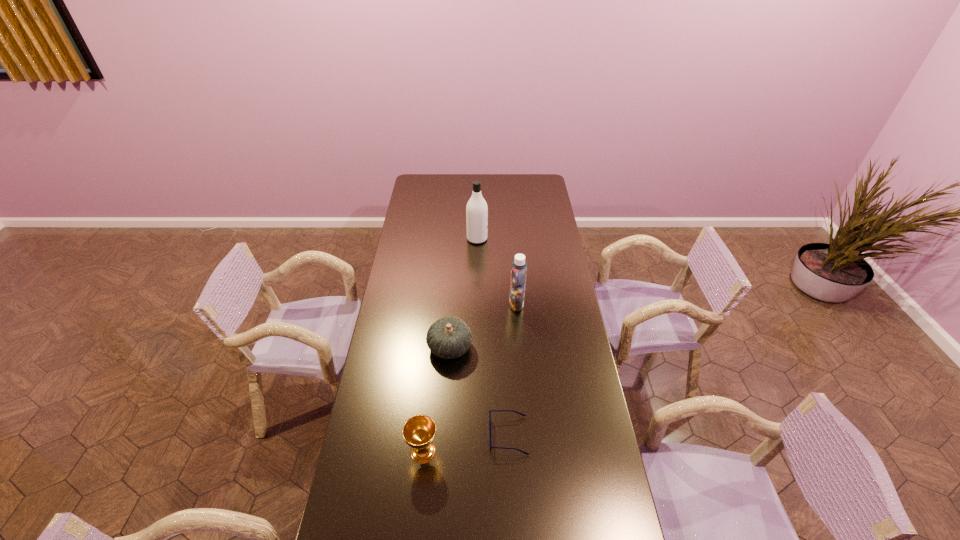
What are the coordinates of `vacant space located 0.190m on the front label of the fourth shortest object` in the screenshot? It's located at (466, 304).

At what (x,y) coordinates should I click in order to perform the action: click on vacant area located on the right of the third nearest object. Please return your answer as a coordinate pair (x, y). Looking at the image, I should click on (562, 348).

This screenshot has width=960, height=540. In order to click on vacant region located on the front of the chalice in this screenshot , I will do `click(417, 514)`.

Locate an element on the screen. The width and height of the screenshot is (960, 540). vacant space located on the front-facing side of the spectacles is located at coordinates (459, 435).

The image size is (960, 540). Find the location of `vacant region located on the front-facing side of the spectacles`. vacant region located on the front-facing side of the spectacles is located at coordinates (444, 435).

The height and width of the screenshot is (540, 960). Identify the location of vacant space located on the front-facing side of the spectacles. (459, 435).

Image resolution: width=960 pixels, height=540 pixels. What are the coordinates of `vacant space at the far edge of the desktop` in the screenshot? It's located at (471, 177).

Where is `free region at the left edge of the desktop`? The height and width of the screenshot is (540, 960). free region at the left edge of the desktop is located at coordinates (425, 276).

In the image, there is a desktop. At what (x,y) coordinates should I click in order to perform the action: click on free space at the right edge. Please return your answer as a coordinate pair (x, y). The height and width of the screenshot is (540, 960). Looking at the image, I should click on (556, 232).

At what (x,y) coordinates should I click in order to perform the action: click on vacant space that is in between the third nearest object and the spectacles. Please return your answer as a coordinate pair (x, y). The width and height of the screenshot is (960, 540). Looking at the image, I should click on click(x=479, y=392).